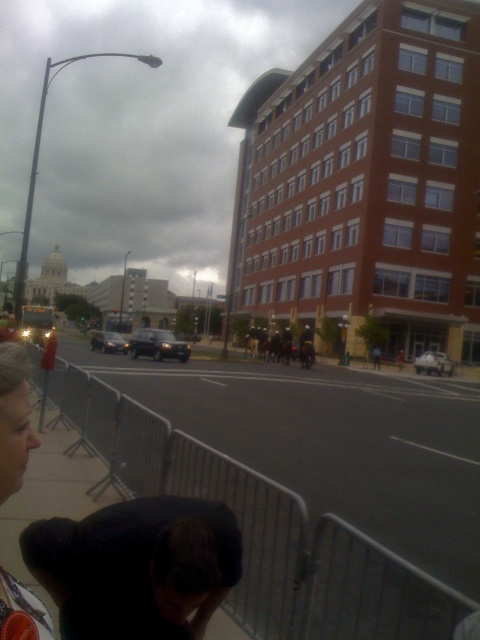
You are standing on the sidewalk and see two points marked in the scene. The first point is at coordinates point (240, 465) and the second is at point (58, 532). Which point is closer to you?

Point (240, 465) is closer to you because it is further to the viewer than point (58, 532).

Based on the photo, you are a delivery person trying to navigate through the street. You see the matte black hair at lower left and the dark gray matte suv at center. Which object is positioned higher in the image?

The matte black hair at lower left is located above the dark gray matte suv at center, so it is positioned higher in the image.